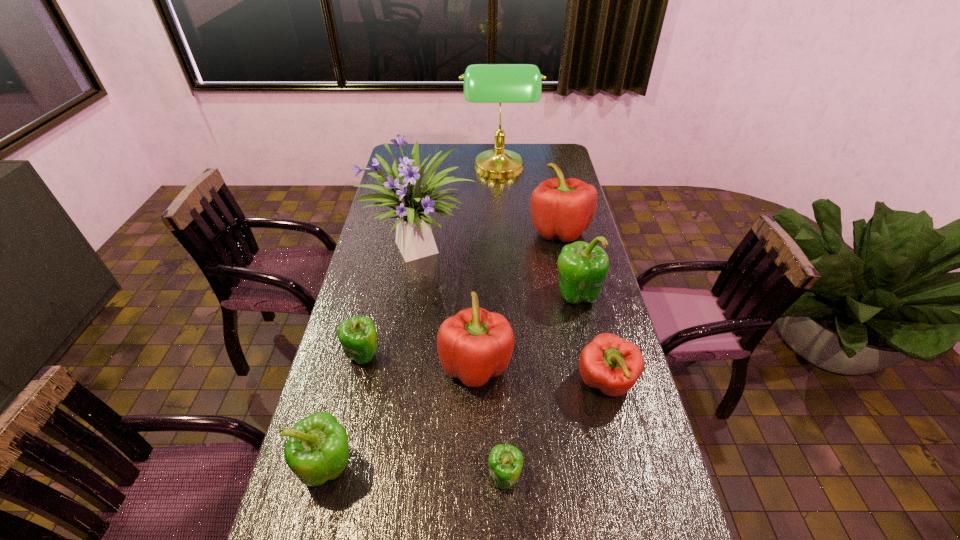
You are a GUI agent. You are given a task and a screenshot of the screen. Output one action in this format:
    pyautogui.click(x=<x>, y=<y>)
    Task: Click on the free area in between the farthest green bell pepper and the shortest bell pepper
    Image resolution: width=960 pixels, height=540 pixels.
    Given the screenshot: What is the action you would take?
    (x=540, y=386)

The height and width of the screenshot is (540, 960). In order to click on free spot between the farthest green bell pepper and the second biggest pink bell pepper in this screenshot , I will do `click(526, 329)`.

Find the location of a particular element. The width and height of the screenshot is (960, 540). free space between the third smallest green bell pepper and the leftmost pink bell pepper is located at coordinates (403, 416).

The image size is (960, 540). Identify the location of free space between the green flower arrangement and the farthest object. (461, 210).

The height and width of the screenshot is (540, 960). I want to click on empty space between the biggest pink bell pepper and the smallest green bell pepper, so click(532, 354).

The image size is (960, 540). In order to click on free point between the second farthest green bell pepper and the second biggest green bell pepper in this screenshot , I will do `click(347, 411)`.

The width and height of the screenshot is (960, 540). What are the coordinates of `free spot between the green flower arrangement and the third nearest green bell pepper` in the screenshot? It's located at (393, 302).

Identify the location of object that is the sixth closest to the farthest pink bell pepper. The image size is (960, 540). (358, 337).

Point out which object is positioned as the fourth nearest to the green flower arrangement. Please provide its 2D coordinates. Your answer should be formatted as a tuple, i.e. [(x, y)], where the tuple contains the x and y coordinates of a point satisfying the conditions above.

[(483, 83)]

This screenshot has height=540, width=960. I want to click on the closest bell pepper to the farthest bell pepper, so click(583, 268).